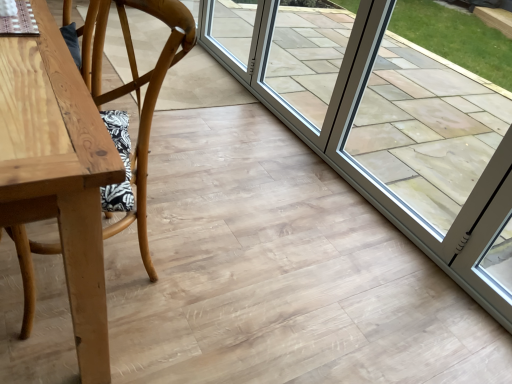
Question: Relative to wooden chair at left, is transparent glass door at right in front or behind?

Choices:
 (A) behind
 (B) front

Answer: (A)

Question: Is point (454, 109) positioned closer to the camera than point (140, 157)?

Choices:
 (A) closer
 (B) farther

Answer: (B)

Question: Which object is positioned closest to the transparent glass door at right?

Choices:
 (A) wooden chair at left
 (B) clear glass door at center

Answer: (B)

Question: Which is nearer to the wooden chair at left?

Choices:
 (A) transparent glass door at right
 (B) clear glass door at center

Answer: (A)